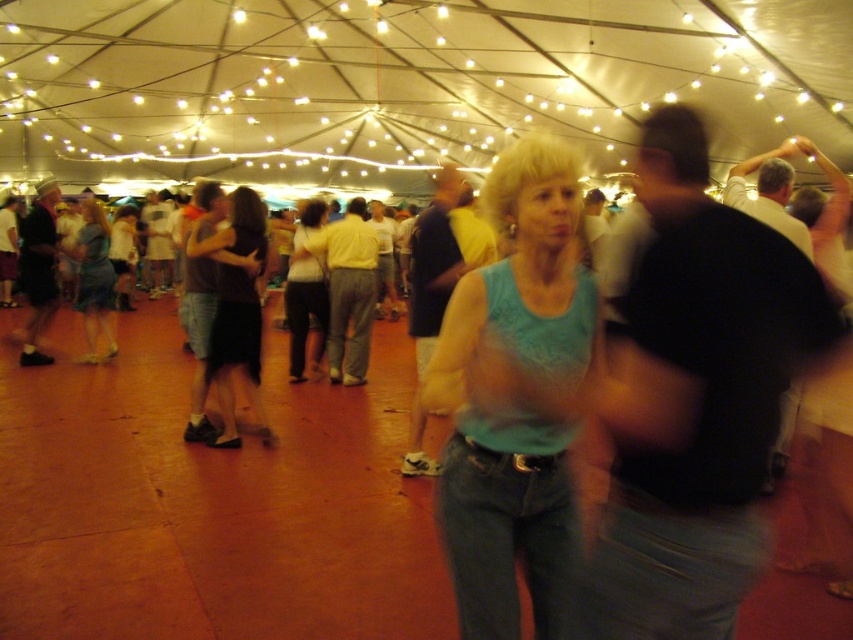
Question: Estimate the real-world distances between objects in this image. Which object is farther from the light blue fabric shirt at center?

Choices:
 (A) dark brown skirt at center
 (B) matte black dress at center

Answer: (B)

Question: Which point is closer to the camera?

Choices:
 (A) (264, 253)
 (B) (317, 337)
 (C) (91, 244)

Answer: (A)

Question: In this image, where is light blue fabric shirt at center located relative to matte black dress at center?

Choices:
 (A) above
 (B) below

Answer: (B)

Question: Does teal fabric tank top at center have a larger size compared to matte black dress at center?

Choices:
 (A) yes
 (B) no

Answer: (B)

Question: Is dark brown skirt at center behind matte black dress at center?

Choices:
 (A) yes
 (B) no

Answer: (B)

Question: Which object appears closest to the camera in this image?

Choices:
 (A) matte black dress at center
 (B) dark brown skirt at center

Answer: (B)